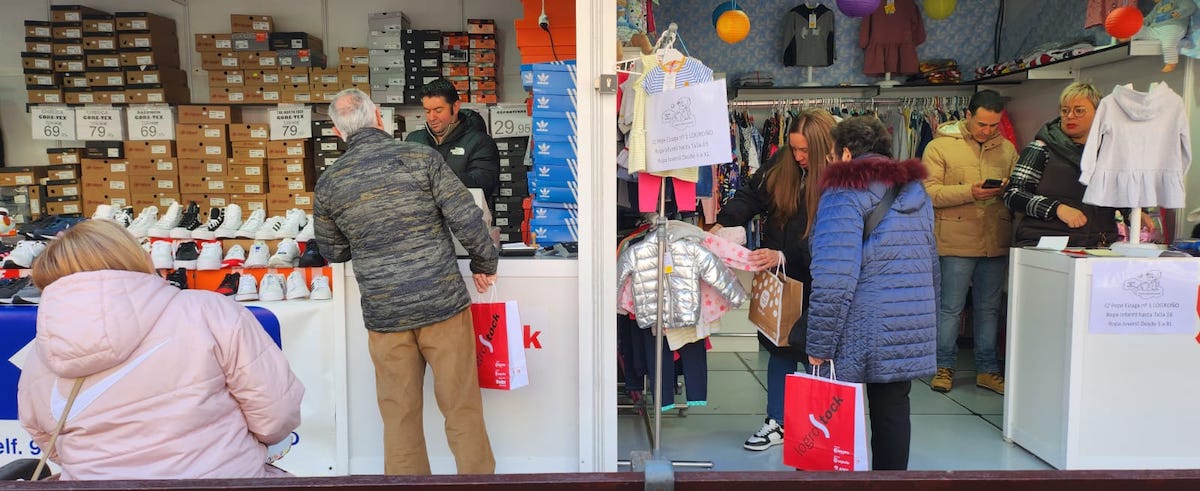
The height and width of the screenshot is (491, 1200). What are the coordinates of `white tile floor` in the screenshot? It's located at (953, 456).